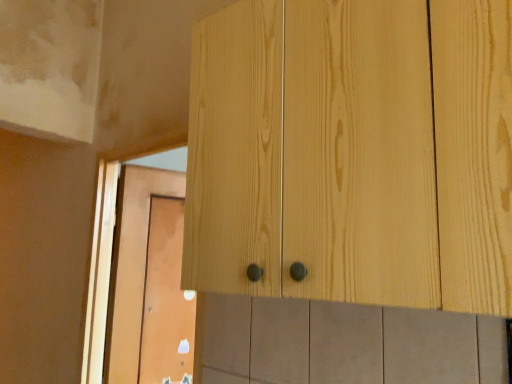
At what (x,y) coordinates should I click in order to perform the action: click on free point above natural wood door at upper center (from a real-world perspective). Please return your answer as a coordinate pair (x, y). Image resolution: width=512 pixels, height=384 pixels. Looking at the image, I should click on (154, 168).